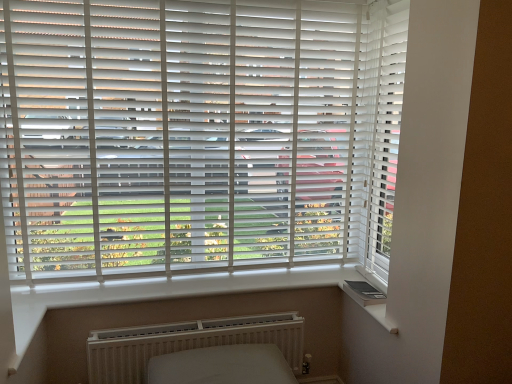
Question: Can you confirm if white smooth window sill at lower right is thinner than white matte blinds at center?

Choices:
 (A) yes
 (B) no

Answer: (B)

Question: From the image's perspective, is white smooth window sill at lower right beneath white matte blinds at center?

Choices:
 (A) no
 (B) yes

Answer: (B)

Question: Does white smooth window sill at lower right have a smaller size compared to white matte blinds at center?

Choices:
 (A) no
 (B) yes

Answer: (B)

Question: Does white smooth window sill at lower right have a larger size compared to white matte blinds at center?

Choices:
 (A) no
 (B) yes

Answer: (A)

Question: Does white smooth window sill at lower right have a lesser height compared to white matte blinds at center?

Choices:
 (A) yes
 (B) no

Answer: (A)

Question: Is point (388, 327) positioned closer to the camera than point (148, 344)?

Choices:
 (A) closer
 (B) farther

Answer: (A)

Question: From a real-world perspective, is white smooth window sill at lower right above or below white textured radiator at lower center?

Choices:
 (A) above
 (B) below

Answer: (A)

Question: Looking at their shapes, would you say white smooth window sill at lower right is wider or thinner than white textured radiator at lower center?

Choices:
 (A) wide
 (B) thin

Answer: (A)

Question: In terms of size, does white smooth window sill at lower right appear bigger or smaller than white textured radiator at lower center?

Choices:
 (A) small
 (B) big

Answer: (A)

Question: Choose the correct answer: Is white textured radiator at lower center inside white matte blinds at center or outside it?

Choices:
 (A) inside
 (B) outside

Answer: (B)

Question: Does point tap(263, 327) appear closer or farther from the camera than point tap(104, 135)?

Choices:
 (A) closer
 (B) farther

Answer: (B)

Question: From the image's perspective, is white textured radiator at lower center positioned above or below white matte blinds at center?

Choices:
 (A) above
 (B) below

Answer: (B)

Question: Visually, is white textured radiator at lower center positioned to the left or to the right of white matte blinds at center?

Choices:
 (A) left
 (B) right

Answer: (B)

Question: Is point (96, 372) closer or farther from the camera than point (373, 317)?

Choices:
 (A) farther
 (B) closer

Answer: (A)

Question: Considering the positions of white textured radiator at lower center and white smooth window sill at lower right in the image, is white textured radiator at lower center bigger or smaller than white smooth window sill at lower right?

Choices:
 (A) small
 (B) big

Answer: (B)